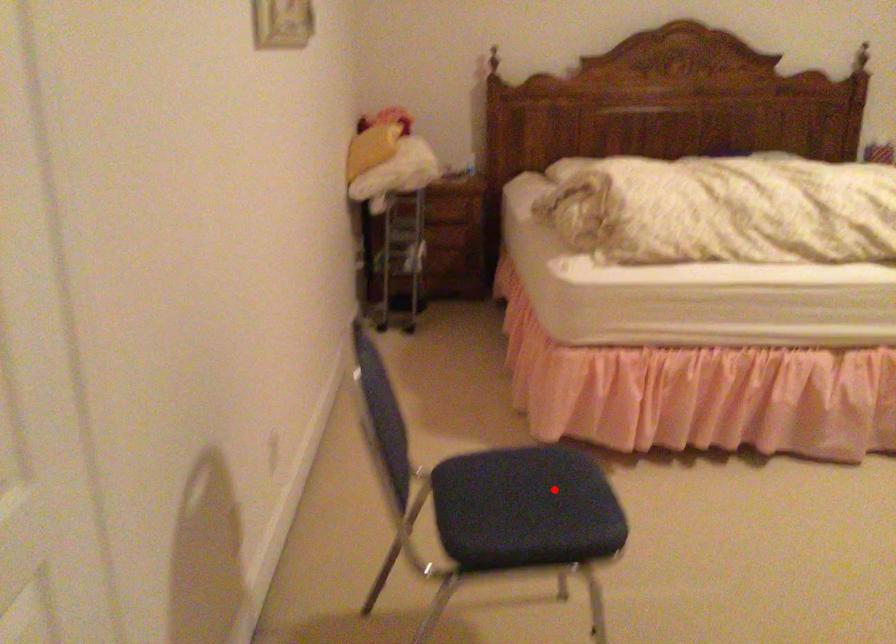
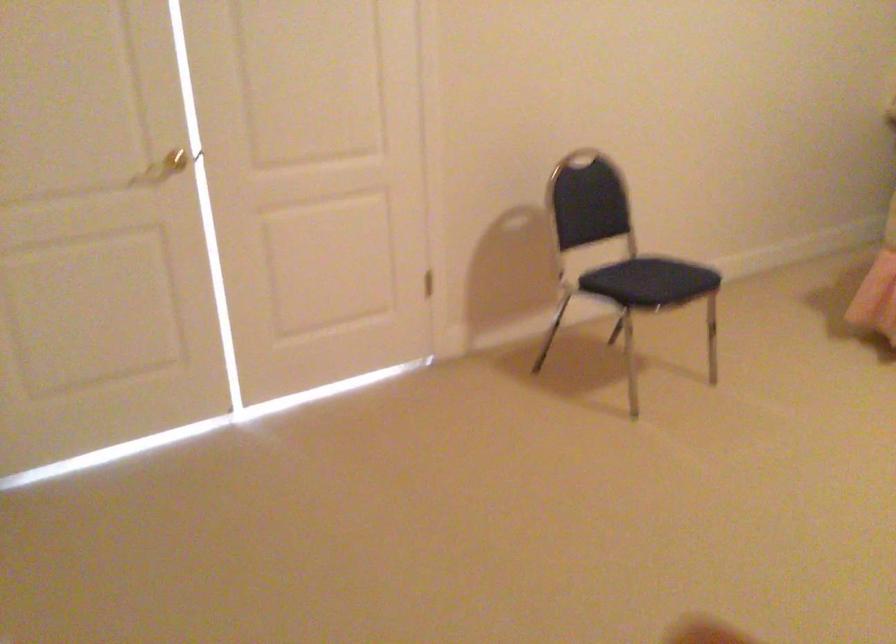
Where in the second image is the point corresponding to the highlighted location from the first image?

(657, 276)